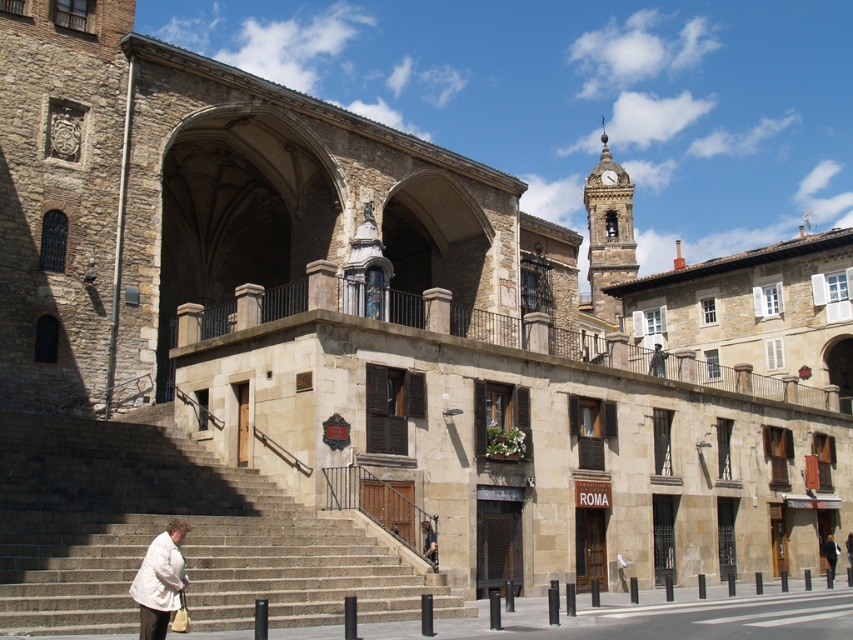
You are a tailor trying to fit two customers in the historic building. The first customer is wearing the dark brown leather jacket at lower center, and the second is wearing the light beige coat at lower center. Which customer needs a larger fitting room?

The customer wearing the dark brown leather jacket at lower center needs a larger fitting room since it is larger in size than the light beige coat at lower center.

You are a tailor standing in front of the historic building and you see both the dark brown leather jacket at lower center and the light beige coat at lower center. Which one is taller?

The dark brown leather jacket at lower center is taller than the light beige coat at lower center.